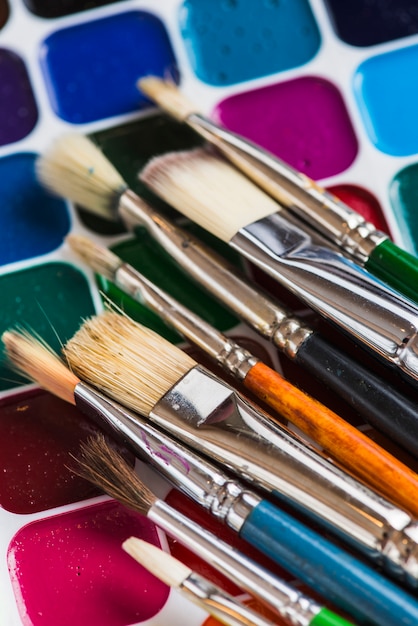
Where is `warm colors of paint`? warm colors of paint is located at coordinates (76, 578), (191, 558), (261, 608), (385, 444), (357, 201), (258, 351), (33, 442), (286, 126).